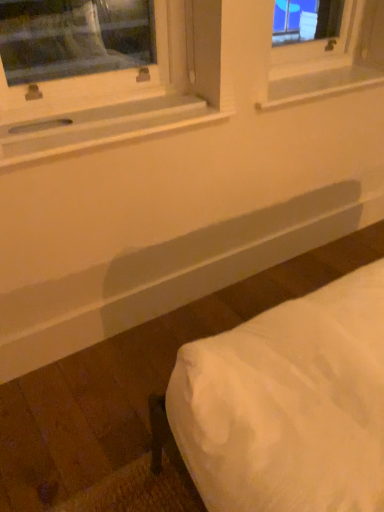
Question: Is white plastic window sill at upper center, placed as the first window sill when sorted from back to front, next to white wood window sill at upper left, acting as the second window sill starting from the back, and touching it?

Choices:
 (A) yes
 (B) no

Answer: (B)

Question: Is white plastic window sill at upper center, which ranks as the 1th window sill in right-to-left order, positioned with its back to white wood window sill at upper left, the 1th window sill in the left-to-right sequence?

Choices:
 (A) no
 (B) yes

Answer: (A)

Question: Does white plastic window sill at upper center, placed as the 2th window sill when sorted from front to back, appear on the left side of white wood window sill at upper left, positioned as the second window sill in right-to-left order?

Choices:
 (A) yes
 (B) no

Answer: (B)

Question: From a real-world perspective, is white plastic window sill at upper center, placed as the 2th window sill when sorted from front to back, located higher than white wood window sill at upper left, the 1th window sill in the left-to-right sequence?

Choices:
 (A) yes
 (B) no

Answer: (B)

Question: Is white plastic window sill at upper center, positioned as the second window sill in left-to-right order, positioned before white wood window sill at upper left, the 1th window sill in the left-to-right sequence?

Choices:
 (A) no
 (B) yes

Answer: (A)

Question: Considering the positions of white wood window sill at upper left, the 1th window sill in the left-to-right sequence, and white fabric bed at lower right in the image, is white wood window sill at upper left, the 1th window sill in the left-to-right sequence, wider or thinner than white fabric bed at lower right?

Choices:
 (A) wide
 (B) thin

Answer: (B)

Question: Is white wood window sill at upper left, which ranks as the 1th window sill in front-to-back order, inside the boundaries of white fabric bed at lower right, or outside?

Choices:
 (A) outside
 (B) inside

Answer: (A)

Question: In terms of height, does white wood window sill at upper left, which ranks as the 1th window sill in front-to-back order, look taller or shorter compared to white fabric bed at lower right?

Choices:
 (A) tall
 (B) short

Answer: (B)

Question: Is white wood window sill at upper left, acting as the second window sill starting from the back, in front of or behind white fabric bed at lower right in the image?

Choices:
 (A) front
 (B) behind

Answer: (B)

Question: Is white fabric bed at lower right situated inside white wood window sill at upper left, acting as the second window sill starting from the back, or outside?

Choices:
 (A) inside
 (B) outside

Answer: (B)

Question: Based on their sizes in the image, would you say white fabric bed at lower right is bigger or smaller than white wood window sill at upper left, acting as the second window sill starting from the back?

Choices:
 (A) small
 (B) big

Answer: (B)

Question: From a real-world perspective, is white fabric bed at lower right physically located above or below white wood window sill at upper left, acting as the second window sill starting from the back?

Choices:
 (A) above
 (B) below

Answer: (B)

Question: Considering the positions of point (360, 510) and point (198, 118), is point (360, 510) closer or farther from the camera than point (198, 118)?

Choices:
 (A) farther
 (B) closer

Answer: (B)

Question: Considering their positions, is white wood window sill at upper left, which ranks as the 1th window sill in front-to-back order, located in front of or behind white plastic window sill at upper center, positioned as the second window sill in left-to-right order?

Choices:
 (A) behind
 (B) front

Answer: (B)

Question: Looking at the image, does white wood window sill at upper left, positioned as the second window sill in right-to-left order, seem bigger or smaller compared to white plastic window sill at upper center, which ranks as the 1th window sill in right-to-left order?

Choices:
 (A) big
 (B) small

Answer: (A)